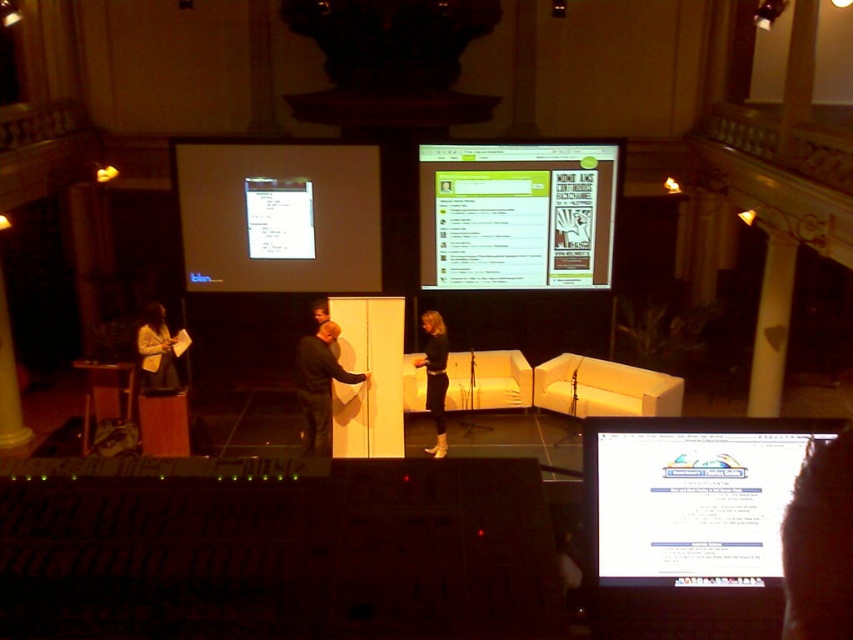
You are sitting in the auditorium and want to see both the white matte projector screen at upper left and the light beige sweater at lower left. Which one is closer to you?

The white matte projector screen at upper left is closer to you since it is in front of the light beige sweater at lower left.

You are sitting in the front row of the conference hall and want to look at both the white glossy computer screen at center and the white matte projector screen at upper left. Which screen will you need to tilt your head upwards more to see?

The white matte projector screen at upper left requires tilting your head upwards more because it is further away from the viewer compared to the white glossy computer screen at center.